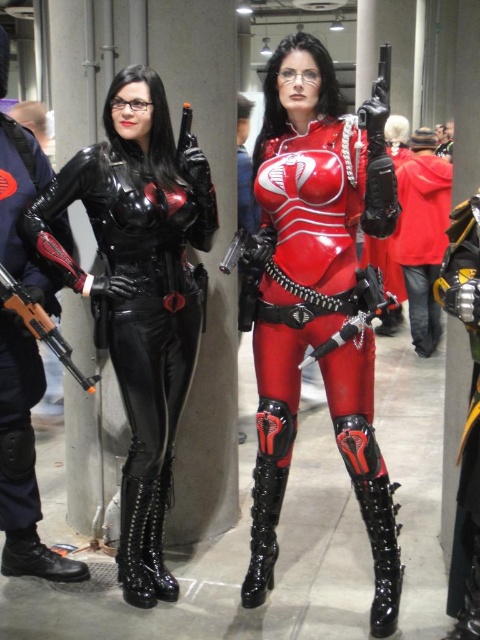
Does glossy red latex suit at center come in front of polished black revolver at center?

No, glossy red latex suit at center is further to the viewer.

Does glossy red latex suit at center appear over polished black revolver at center?

No, glossy red latex suit at center is not above polished black revolver at center.

Identify the location of glossy red latex suit at center. (307, 252).

This screenshot has width=480, height=640. What are the coordinates of `glossy red latex suit at center` in the screenshot? It's located at (307, 252).

Identify the location of matte black leather suit at center. This screenshot has width=480, height=640. (139, 292).

Which is in front, point (173, 145) or point (36, 310)?

Point (36, 310) is in front.

The image size is (480, 640). What are the coordinates of `matte black leather suit at center` in the screenshot? It's located at (139, 292).

Does glossy red latex suit at center have a lesser width compared to black leather pants at left?

Incorrect, glossy red latex suit at center's width is not less than black leather pants at left's.

Who is shorter, glossy red latex suit at center or black leather pants at left?

black leather pants at left is shorter.

Between point (288, 464) and point (7, 145), which one is positioned in front?

Point (7, 145) is in front.

Image resolution: width=480 pixels, height=640 pixels. I want to click on glossy red latex suit at center, so click(307, 252).